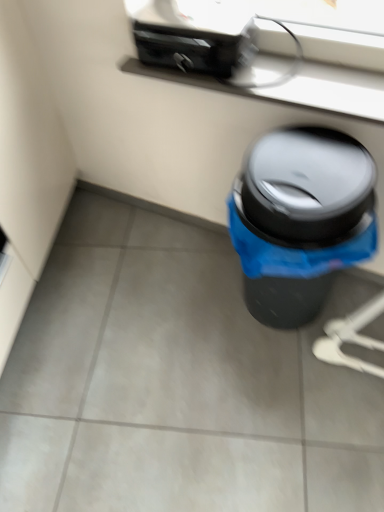
Question: Can you confirm if black plastic trash can at lower right is shorter than black plastic toaster at upper center?

Choices:
 (A) no
 (B) yes

Answer: (A)

Question: Considering the relative sizes of black plastic trash can at lower right and black plastic toaster at upper center in the image provided, is black plastic trash can at lower right taller than black plastic toaster at upper center?

Choices:
 (A) no
 (B) yes

Answer: (B)

Question: Is black plastic trash can at lower right oriented away from black plastic toaster at upper center?

Choices:
 (A) no
 (B) yes

Answer: (A)

Question: Considering the relative sizes of black plastic trash can at lower right and black plastic toaster at upper center in the image provided, is black plastic trash can at lower right thinner than black plastic toaster at upper center?

Choices:
 (A) yes
 (B) no

Answer: (B)

Question: Is black plastic trash can at lower right at the left side of black plastic toaster at upper center?

Choices:
 (A) no
 (B) yes

Answer: (A)

Question: Is the position of black plastic trash can at lower right more distant than that of black plastic toaster at upper center?

Choices:
 (A) no
 (B) yes

Answer: (A)

Question: Does black plastic toaster at upper center have a lesser width compared to black plastic trash can at lower right?

Choices:
 (A) yes
 (B) no

Answer: (A)

Question: Is black plastic toaster at upper center facing towards black plastic trash can at lower right?

Choices:
 (A) no
 (B) yes

Answer: (A)

Question: Does black plastic toaster at upper center come behind black plastic trash can at lower right?

Choices:
 (A) no
 (B) yes

Answer: (B)

Question: Does black plastic toaster at upper center lie in front of black plastic trash can at lower right?

Choices:
 (A) no
 (B) yes

Answer: (A)

Question: Considering the relative positions of black plastic toaster at upper center and black plastic trash can at lower right in the image provided, is black plastic toaster at upper center to the left of black plastic trash can at lower right from the viewer's perspective?

Choices:
 (A) yes
 (B) no

Answer: (A)

Question: Can you confirm if black plastic toaster at upper center is wider than black plastic trash can at lower right?

Choices:
 (A) yes
 (B) no

Answer: (B)

Question: Can you confirm if satin black window sill at upper center is taller than black plastic trash can at lower right?

Choices:
 (A) no
 (B) yes

Answer: (A)